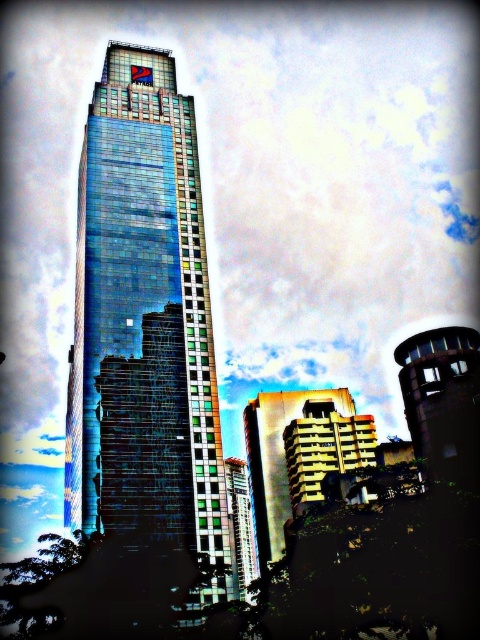
Who is positioned more to the left, shiny glass skyscraper at center or rustic metal tower at lower right?

shiny glass skyscraper at center is more to the left.

Does point (136, 186) come behind point (472, 401)?

That is True.

What are the coordinates of `shiny glass skyscraper at center` in the screenshot? It's located at (144, 326).

Is rustic metal tower at lower right taller than green glass building at lower center?

In fact, rustic metal tower at lower right may be shorter than green glass building at lower center.

Does point (416, 360) come closer to viewer compared to point (249, 502)?

Yes, it is.

Where is `rustic metal tower at lower right`? The height and width of the screenshot is (640, 480). rustic metal tower at lower right is located at coordinates (443, 401).

In the scene shown: Can you confirm if shiny glass skyscraper at center is thinner than green glass building at lower center?

No.

Can you confirm if shiny glass skyscraper at center is taller than green glass building at lower center?

Yes, shiny glass skyscraper at center is taller than green glass building at lower center.

You are a GUI agent. You are given a task and a screenshot of the screen. Output one action in this format:
    pyautogui.click(x=<x>, y=<y>)
    Task: Click on the shiny glass skyscraper at center
    
    Given the screenshot: What is the action you would take?
    pyautogui.click(x=144, y=326)